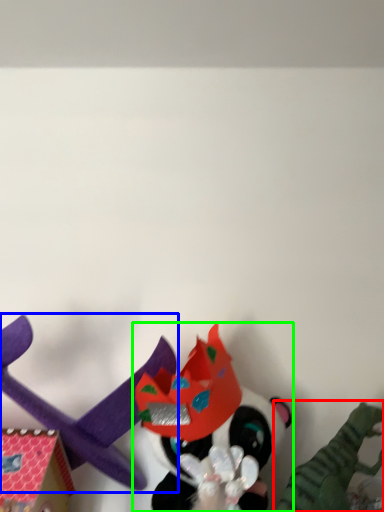
Question: Considering the real-world distances, which object is closest to toy (highlighted by a red box)? toy (highlighted by a blue box) or toy (highlighted by a green box).

Choices:
 (A) toy
 (B) toy

Answer: (B)